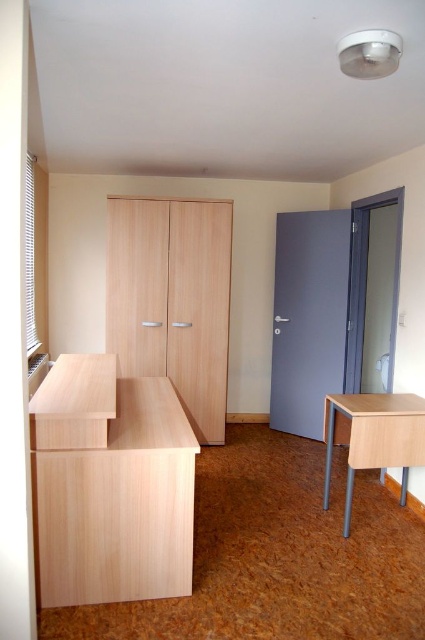
Question: Which object is the farthest from the matte wood drawer at lower right?

Choices:
 (A) matte wood desk at center
 (B) light wood table at lower left
 (C) matte wood drawer at lower left
 (D) light brown wooden table at right

Answer: (C)

Question: Does matte wood desk at center have a greater width compared to light wood table at lower left?

Choices:
 (A) yes
 (B) no

Answer: (A)

Question: Which point is closer to the camera taking this photo?

Choices:
 (A) (x=73, y=572)
 (B) (x=340, y=429)
 (C) (x=70, y=380)

Answer: (A)

Question: Among these points, which one is nearest to the camera?

Choices:
 (A) (334, 422)
 (B) (422, 438)

Answer: (B)

Question: Can you confirm if light wood table at lower left is positioned above matte wood drawer at lower right?

Choices:
 (A) no
 (B) yes

Answer: (B)

Question: Does light wood table at lower left appear on the right side of matte wood drawer at lower right?

Choices:
 (A) no
 (B) yes

Answer: (A)